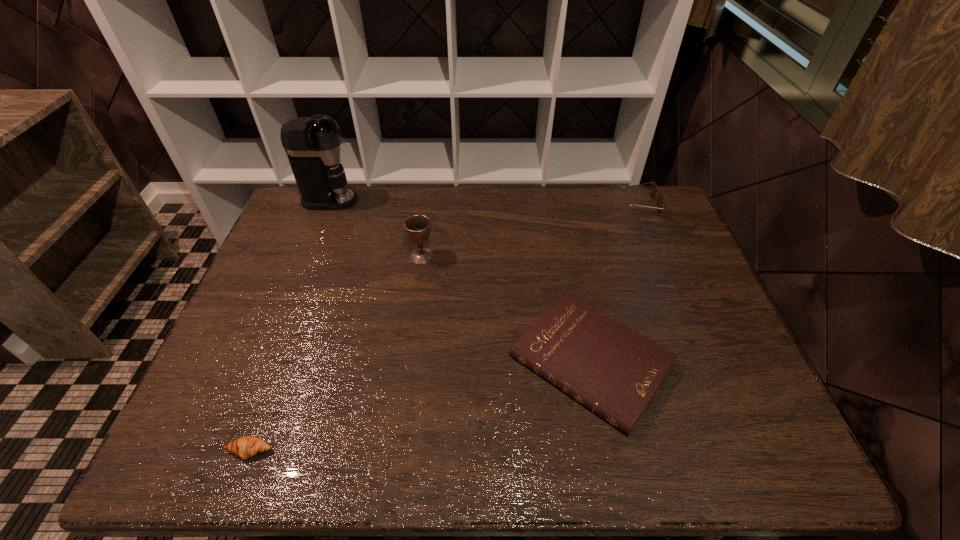
This screenshot has height=540, width=960. I want to click on object present at the right edge, so click(x=653, y=189).

I want to click on object positioned at the far left corner, so click(x=313, y=145).

Find the location of `object that is at the near left corner`. object that is at the near left corner is located at coordinates (245, 447).

Where is `object that is at the far right corner`? Image resolution: width=960 pixels, height=540 pixels. object that is at the far right corner is located at coordinates (653, 189).

Find the location of a particular element. This screenshot has height=540, width=960. vacant point at the far edge is located at coordinates (450, 226).

What are the coordinates of `vacant space at the right edge of the desktop` in the screenshot? It's located at (676, 353).

Locate an element on the screen. This screenshot has height=540, width=960. free space at the near left corner of the desktop is located at coordinates (216, 436).

You are a GUI agent. You are given a task and a screenshot of the screen. Output one action in this format:
    pyautogui.click(x=<x>, y=<y>)
    Task: Click on the free spot between the tallest object and the third tallest object
    The height and width of the screenshot is (540, 960).
    Given the screenshot: What is the action you would take?
    (485, 202)

Locate an element on the screen. free space that is in between the third shortest object and the fourth object from left to right is located at coordinates point(615,282).

Where is `empty space that is in between the tallest object and the second nearest object`? empty space that is in between the tallest object and the second nearest object is located at coordinates (460, 281).